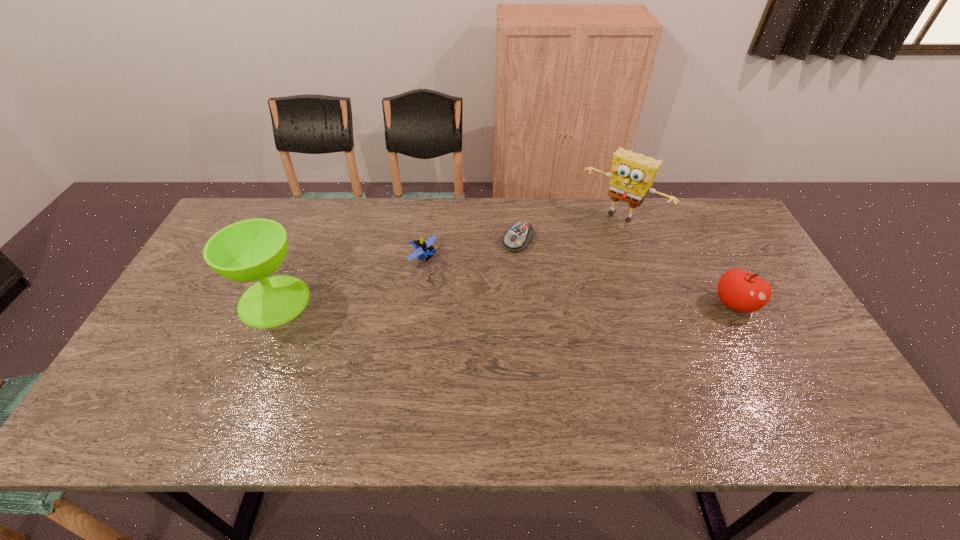
At what (x,y) coordinates should I click in order to perform the action: click on the leftmost object. Please return your answer as a coordinate pair (x, y). Looking at the image, I should click on (250, 250).

Find the location of a particular element. The width and height of the screenshot is (960, 540). the third shortest object is located at coordinates (739, 290).

I want to click on the rightmost object, so click(x=739, y=290).

Locate an element on the screen. The height and width of the screenshot is (540, 960). Lego is located at coordinates click(423, 248).

Find the location of a particular element. The image size is (960, 540). the second shortest object is located at coordinates (423, 248).

The height and width of the screenshot is (540, 960). I want to click on the second object from right to left, so click(632, 174).

You are a GUI agent. You are given a task and a screenshot of the screen. Output one action in this format:
    pyautogui.click(x=<x>, y=<y>)
    Task: Click on the third object from right to left
    This screenshot has height=540, width=960.
    Given the screenshot: What is the action you would take?
    pyautogui.click(x=517, y=238)

This screenshot has height=540, width=960. I want to click on computer mouse, so click(517, 238).

Locate an element on the screen. vacant space situated on the right of the leftmost object is located at coordinates (330, 301).

Locate an element on the screen. This screenshot has width=960, height=540. vacant region located 0.400m on the left of the third shortest object is located at coordinates (567, 305).